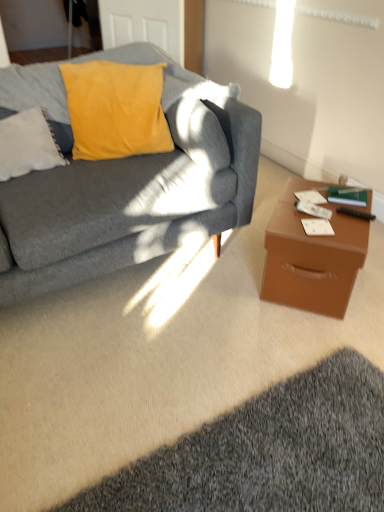
Where is `vacant space that is in between brown leather desk at right and dark gray shaggy rug at lower right`? Image resolution: width=384 pixels, height=512 pixels. vacant space that is in between brown leather desk at right and dark gray shaggy rug at lower right is located at coordinates (238, 356).